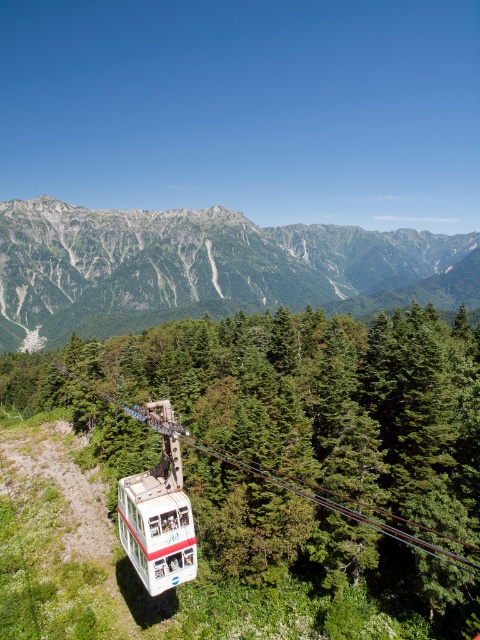
In the scene shown: You are standing at the base of the mountain and looking at the cable car system and the dense forest below. There is a specific point marked at coordinates point (206, 268). What does this point correspond to in the image?

The point (206, 268) corresponds to the green textured mountain at center.

You are a hiker planning to take a photo of the white matte cable car at center and the green textured mountain at center from a viewpoint. Based on their positions, which object will appear closer to you in the photo?

The green textured mountain at center will appear closer to you in the photo because the white matte cable car at center is positioned behind it.

You are a hiker planning to take a photo of the green textured mountain at center from the white matte cable car at center. Given that the cable car is 3 meters wide, can you estimate whether the mountain will fit entirely within the frame of a standard smartphone camera with a 78 degree field of view?

The green textured mountain at center is 358.97 meters from the white matte cable car at center. Using trigonometry, the field of view of 78 degrees allows the camera to capture objects up to approximately 358.97 meters away within its frame. Since the mountain is exactly at this distance, it should fit within the smartphone camera frame.